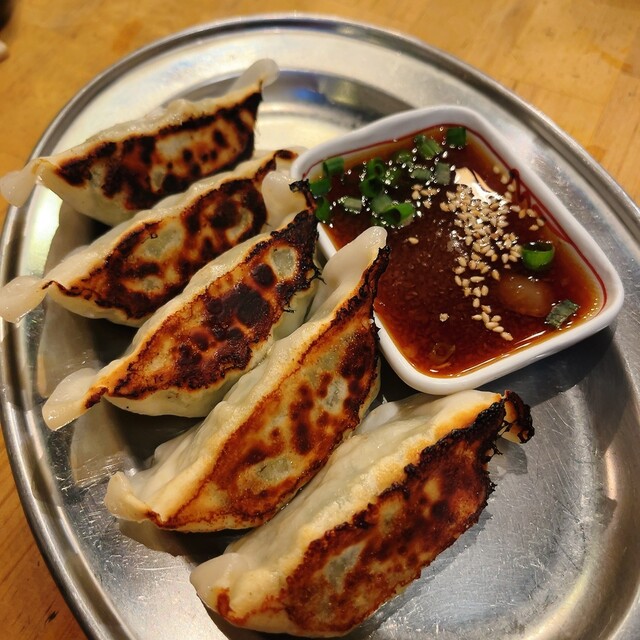
I want to click on white small tray, so click(x=561, y=218).